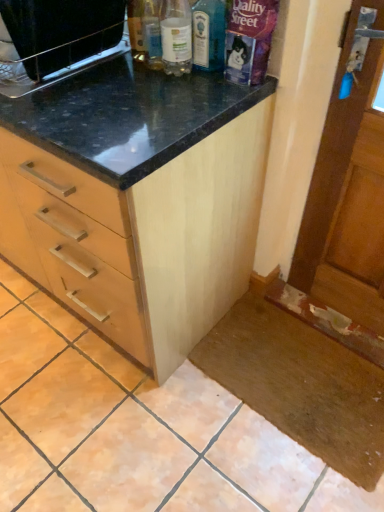
What is the approximate height of brown wooden screen door at right?

1.06 meters.

You are a GUI agent. You are given a task and a screenshot of the screen. Output one action in this format:
    pyautogui.click(x=<x>, y=<y>)
    Task: Click on the brown wooden screen door at right
    
    Given the screenshot: What is the action you would take?
    pyautogui.click(x=347, y=198)

At what (x,y) coordinates should I click in order to perform the action: click on black matte microwave at upper left. Please return your answer as a coordinate pair (x, y). Looking at the image, I should click on (56, 40).

Identify the location of brown wooden screen door at right. The height and width of the screenshot is (512, 384). (347, 198).

From the image's perspective, does black matte microwave at upper left appear lower than light wood cabinet at center?

No, from the image's perspective, black matte microwave at upper left is not beneath light wood cabinet at center.

Is black matte microwave at upper left in contact with light wood cabinet at center?

No, black matte microwave at upper left is not next to light wood cabinet at center.

Looking at this image, which of these two, black matte microwave at upper left or light wood cabinet at center, is smaller?

With smaller size is black matte microwave at upper left.

Is light wood cabinet at center situated inside clear plastic bottle at upper center, the second bottle positioned from the right, or outside?

light wood cabinet at center is not inside clear plastic bottle at upper center, the second bottle positioned from the right, it's outside.

From a real-world perspective, is light wood cabinet at center on top of clear plastic bottle at upper center, which ranks as the first bottle in left-to-right order?

Actually, light wood cabinet at center is physically below clear plastic bottle at upper center, which ranks as the first bottle in left-to-right order, in the real world.

Which of these two, light wood cabinet at center or clear plastic bottle at upper center, which ranks as the first bottle in left-to-right order, is thinner?

Thinner between the two is clear plastic bottle at upper center, which ranks as the first bottle in left-to-right order.

Considering the points (246, 208) and (164, 48), which point is in front, point (246, 208) or point (164, 48)?

Point (164, 48)

In the image, is brown wooden screen door at right positioned in front of or behind translucent glass bottle at center, placed as the second bottle when sorted from left to right?

Clearly, brown wooden screen door at right is in front of translucent glass bottle at center, placed as the second bottle when sorted from left to right.

Looking at this image, who is smaller, brown wooden screen door at right or translucent glass bottle at center, placed as the second bottle when sorted from left to right?

translucent glass bottle at center, placed as the second bottle when sorted from left to right, is smaller.

From the image's perspective, which one is positioned higher, brown wooden screen door at right or translucent glass bottle at center, the 1th bottle when ordered from right to left?

translucent glass bottle at center, the 1th bottle when ordered from right to left, is shown above in the image.

Is point (371, 228) closer or farther from the camera than point (208, 65)?

Clearly, point (371, 228) is more distant from the camera than point (208, 65).

From the image's perspective, is clear plastic bottle at upper center, the second bottle positioned from the right, above or below light wood cabinet at center?

clear plastic bottle at upper center, the second bottle positioned from the right, is situated higher than light wood cabinet at center in the image.

Is clear plastic bottle at upper center, the second bottle positioned from the right, facing towards light wood cabinet at center?

No.

What's the angular difference between clear plastic bottle at upper center, the second bottle positioned from the right, and light wood cabinet at center's facing directions?

0.0358 degrees separate the facing orientations of clear plastic bottle at upper center, the second bottle positioned from the right, and light wood cabinet at center.

Which is more distant, (5, 184) or (357, 183)?

The point (5, 184) is behind.

From a real-world perspective, is light wood cabinet at center positioned above or below brown wooden screen door at right?

light wood cabinet at center is situated lower than brown wooden screen door at right in the real world.

Who is smaller, light wood cabinet at center or brown wooden screen door at right?

With smaller size is brown wooden screen door at right.

Find the location of a particular element. The height and width of the screenshot is (512, 384). cabinetry directly beneath the brown wooden screen door at right (from a real-world perspective) is located at coordinates (137, 200).

Which is farther from the camera, (375, 320) or (185, 34)?

Point (375, 320)

Locate an element on the screen. The height and width of the screenshot is (512, 384). screen door in front of the clear plastic bottle at upper center, the second bottle positioned from the right is located at coordinates tap(347, 198).

Is the surface of brown wooden screen door at right in direct contact with clear plastic bottle at upper center, the second bottle positioned from the right?

No, brown wooden screen door at right is not making contact with clear plastic bottle at upper center, the second bottle positioned from the right.

From the image's perspective, does brown wooden screen door at right appear lower than clear plastic bottle at upper center, which ranks as the first bottle in left-to-right order?

Yes, from the image's perspective, brown wooden screen door at right is below clear plastic bottle at upper center, which ranks as the first bottle in left-to-right order.

From a real-world perspective, who is located higher, translucent glass bottle at center, placed as the second bottle when sorted from left to right, or black matte microwave at upper left?

translucent glass bottle at center, placed as the second bottle when sorted from left to right.

Considering the points (204, 50) and (100, 32), which point is behind, point (204, 50) or point (100, 32)?

The point (100, 32) is behind.

Consider the image. Which is more to the right, translucent glass bottle at center, placed as the second bottle when sorted from left to right, or black matte microwave at upper left?

translucent glass bottle at center, placed as the second bottle when sorted from left to right, is more to the right.

Locate an element on the screen. cabinetry that is on the left side of black matte microwave at upper left is located at coordinates (137, 200).

You are a GUI agent. You are given a task and a screenshot of the screen. Output one action in this format:
    pyautogui.click(x=<x>, y=<y>)
    Task: Click on the cabinetry in front of the clear plastic bottle at upper center, the second bottle positioned from the right
    This screenshot has height=512, width=384.
    Given the screenshot: What is the action you would take?
    pyautogui.click(x=137, y=200)

Based on their spatial positions, is light wood cabinet at center or brown wooden screen door at right closer to black matte microwave at upper left?

Among the two, light wood cabinet at center is located nearer to black matte microwave at upper left.

When comparing their distances from translucent glass bottle at center, placed as the second bottle when sorted from left to right, does black matte microwave at upper left or clear plastic bottle at upper center, which ranks as the first bottle in left-to-right order, seem closer?

clear plastic bottle at upper center, which ranks as the first bottle in left-to-right order.

Based on their spatial positions, is black matte microwave at upper left or light wood cabinet at center further from clear plastic bottle at upper center, which ranks as the first bottle in left-to-right order?

light wood cabinet at center is further to clear plastic bottle at upper center, which ranks as the first bottle in left-to-right order.

From the image, which object appears to be farther from light wood cabinet at center, brown wooden screen door at right or black matte microwave at upper left?

Based on the image, brown wooden screen door at right appears to be further to light wood cabinet at center.

Estimate the real-world distances between objects in this image. Which object is further from translucent glass bottle at center, the 1th bottle when ordered from right to left, black matte microwave at upper left or brown wooden screen door at right?

Based on the image, brown wooden screen door at right appears to be further to translucent glass bottle at center, the 1th bottle when ordered from right to left.

Looking at the image, which one is located further to light wood cabinet at center, black matte microwave at upper left or brown wooden screen door at right?

brown wooden screen door at right is further to light wood cabinet at center.

From the image, which object appears to be nearer to clear plastic bottle at upper center, which ranks as the first bottle in left-to-right order, brown wooden screen door at right or light wood cabinet at center?

light wood cabinet at center.

Based on their spatial positions, is clear plastic bottle at upper center, which ranks as the first bottle in left-to-right order, or translucent glass bottle at center, placed as the second bottle when sorted from left to right, closer to brown wooden screen door at right?

translucent glass bottle at center, placed as the second bottle when sorted from left to right, is positioned closer to the anchor brown wooden screen door at right.

Locate an element on the screen. bottle between black matte microwave at upper left and translucent glass bottle at center, placed as the second bottle when sorted from left to right is located at coordinates pyautogui.click(x=176, y=37).

The image size is (384, 512). I want to click on appliance between light wood cabinet at center and clear plastic bottle at upper center, the second bottle positioned from the right, in the horizontal direction, so click(56, 40).

At what (x,y) coordinates should I click in order to perform the action: click on appliance between light wood cabinet at center and translucent glass bottle at center, the 1th bottle when ordered from right to left, from left to right. Please return your answer as a coordinate pair (x, y). Image resolution: width=384 pixels, height=512 pixels. Looking at the image, I should click on (56, 40).

This screenshot has height=512, width=384. I want to click on bottle situated between clear plastic bottle at upper center, the second bottle positioned from the right, and brown wooden screen door at right from left to right, so pyautogui.click(x=208, y=35).